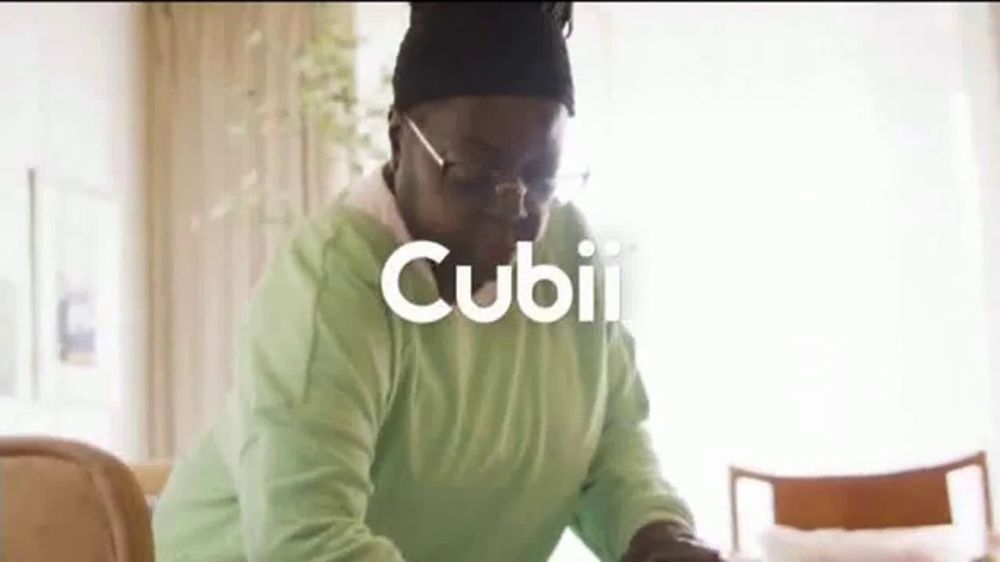
Find the location of a particular element. The height and width of the screenshot is (562, 1000). chair is located at coordinates (55, 494), (879, 490).